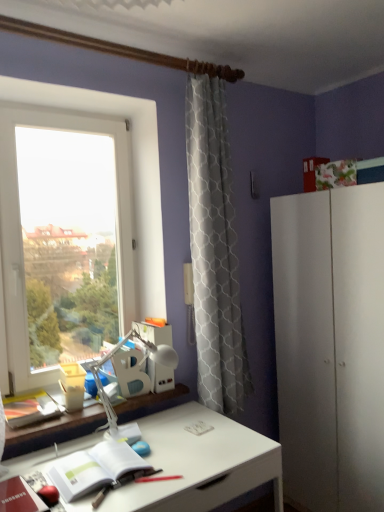
Question: Looking at their shapes, would you say white plastic table lamp at center is wider or thinner than white matte cabinet at right?

Choices:
 (A) wide
 (B) thin

Answer: (B)

Question: Considering their positions, is white plastic table lamp at center located in front of or behind white matte cabinet at right?

Choices:
 (A) front
 (B) behind

Answer: (A)

Question: Which object is positioned farthest from the white paper notebook at lower left?

Choices:
 (A) white matte cabinet at right
 (B) white plastic table lamp at center
 (C) white glossy desk at center
 (D) transparent glass window at left

Answer: (A)

Question: Which object is the farthest from the white glossy desk at center?

Choices:
 (A) white matte cabinet at right
 (B) transparent glass window at left
 (C) white plastic table lamp at center
 (D) white paper notebook at lower left

Answer: (B)